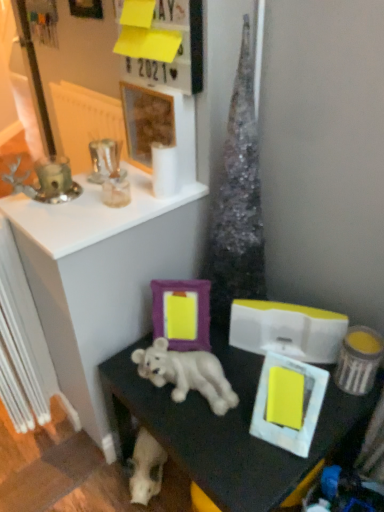
Find the location of a particular element. vacant space to the right of silver metallic candle holder at upper left is located at coordinates (103, 202).